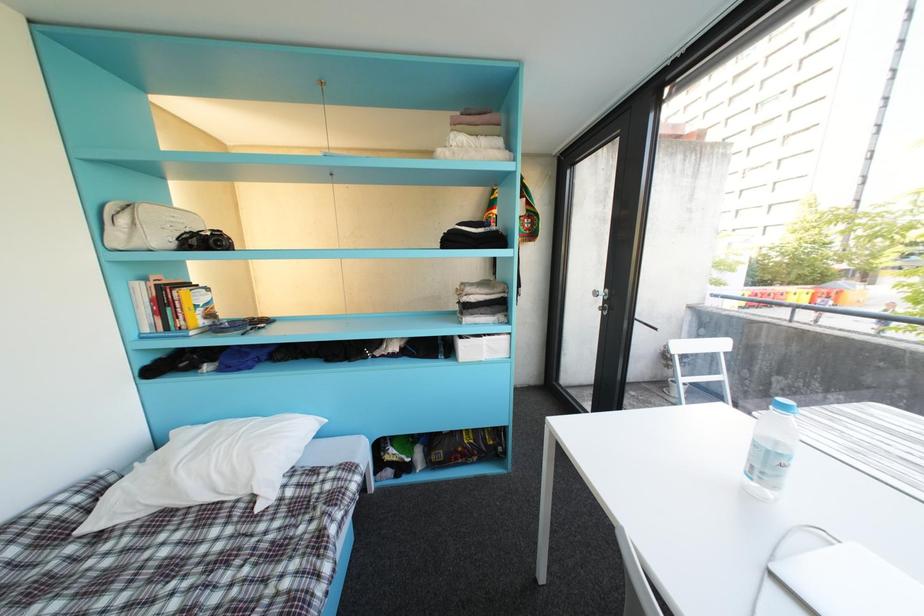
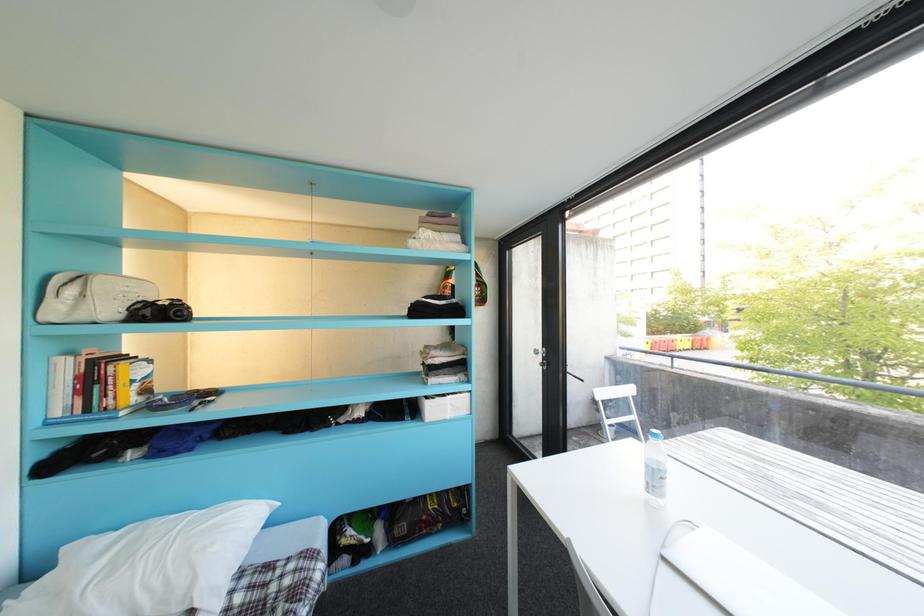
Question: Based on the continuous images, in which direction is the camera rotating? Reply with the corresponding letter.

Choices:
 (A) Left
 (B) Right
 (C) Up
 (D) Down

Answer: (B)